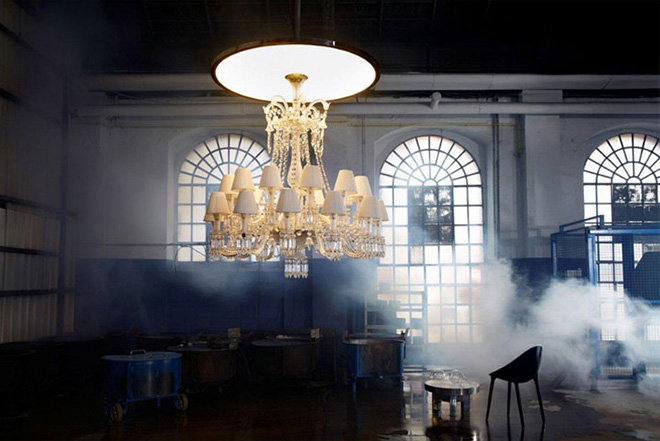
Locate an element on the screen. This screenshot has width=660, height=441. window is located at coordinates (618, 173).